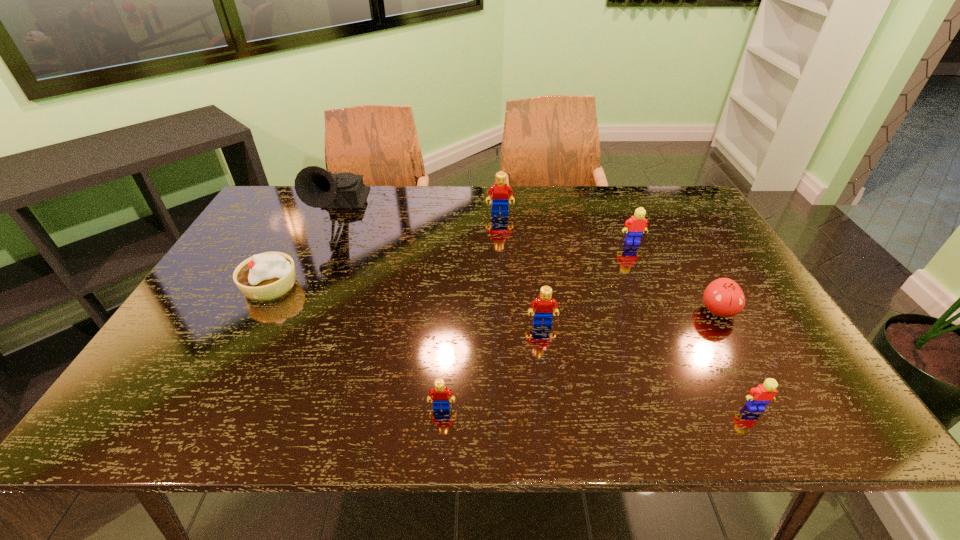
Find the location of a particular element. Image resolution: width=960 pixels, height=540 pixels. free area in between the third object from left to right and the phonograph_record is located at coordinates (390, 309).

You are a GUI agent. You are given a task and a screenshot of the screen. Output one action in this format:
    pyautogui.click(x=<x>, y=<y>)
    Task: Click on the fourth closest object relative to the rightmost Lego
    
    Given the screenshot: What is the action you would take?
    pyautogui.click(x=440, y=393)

Identify which object is the fourth nearest to the beige whipped cream. Please provide its 2D coordinates. Your answer should be formatted as a tuple, i.e. [(x, y)], where the tuple contains the x and y coordinates of a point satisfying the conditions above.

[(544, 304)]

Locate an element on the screen. Lego that is the fourth nearest to the nearer yellow Lego is located at coordinates (499, 191).

Identify which Lego is located as the nearest to the second farthest Lego. Please provide its 2D coordinates. Your answer should be formatted as a tuple, i.e. [(x, y)], where the tuple contains the x and y coordinates of a point satisfying the conditions above.

[(499, 191)]

This screenshot has width=960, height=540. Find the location of `red Lego that is the second nearest to the whipped cream`. red Lego that is the second nearest to the whipped cream is located at coordinates (499, 191).

Locate which red Lego ranks second in proximity to the smallest red Lego. Please provide its 2D coordinates. Your answer should be formatted as a tuple, i.e. [(x, y)], where the tuple contains the x and y coordinates of a point satisfying the conditions above.

[(499, 191)]